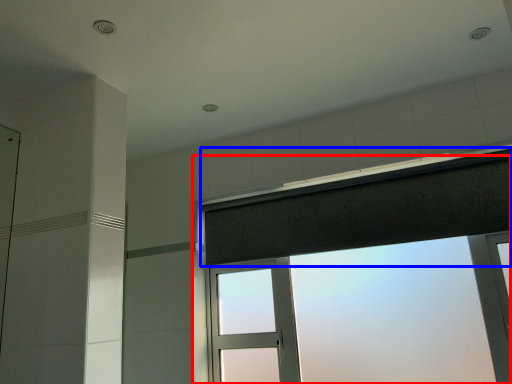
Question: Which of the following is the farthest to the observer, window (highlighted by a red box) or shower curtain (highlighted by a blue box)?

Choices:
 (A) window
 (B) shower curtain

Answer: (B)